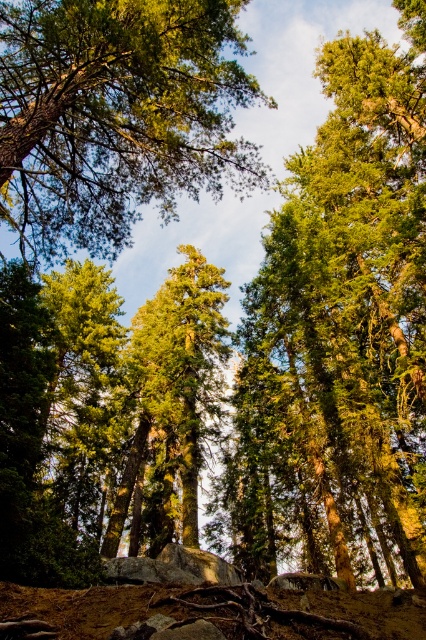
You are standing in the forest looking up. You see a point at coordinates (342, 320). Based on the scene description, what is the point likely located on?

The point at coordinates (342, 320) is on the green textured tree at center.

You are a bird seeking shelter in the forest. You see the green textured tree at center and the green rough bark tree at upper center. Which tree would provide more coverage for nesting?

The green textured tree at center is bigger than the green rough bark tree at upper center, so it would provide more coverage for nesting.

You are standing in the forest and looking up. You see the green textured tree at center and the green rough bark tree at upper center. Which tree is positioned to the right side of the other?

The green textured tree at center is positioned to the right of the green rough bark tree at upper center.